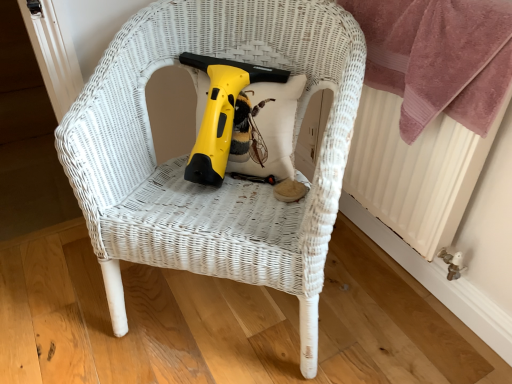
The width and height of the screenshot is (512, 384). I want to click on free point below white textured radiator at right (from a real-world perspective), so click(x=387, y=258).